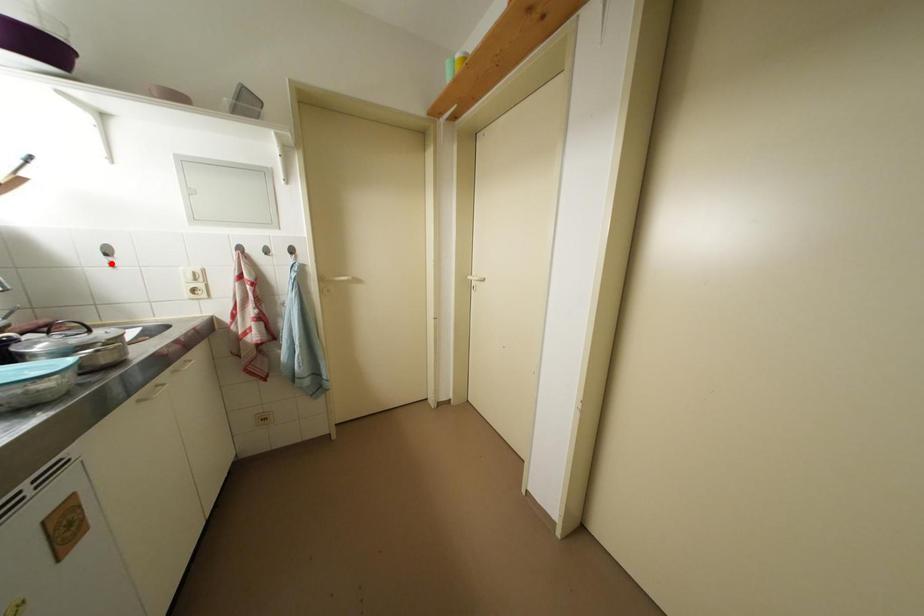
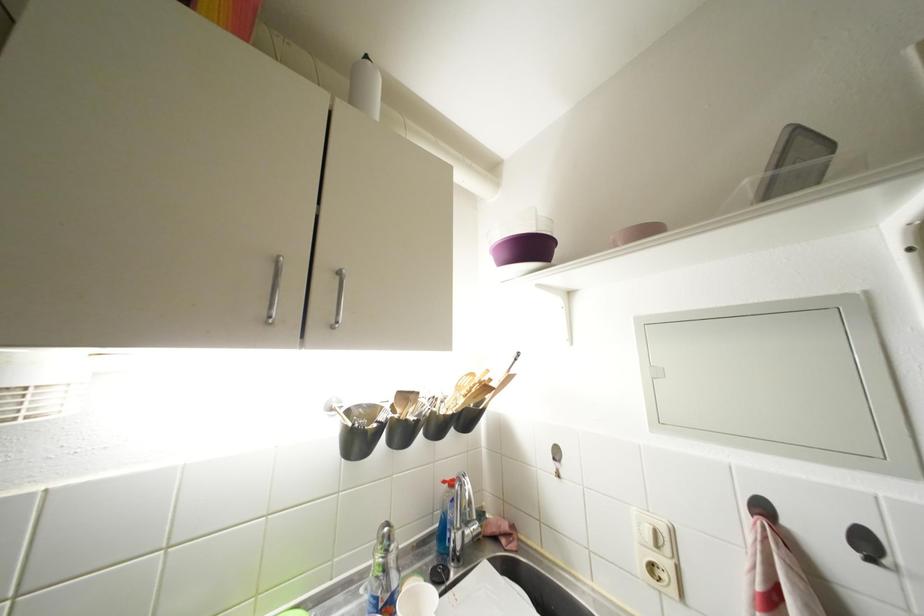
Question: I am providing you with two images of the same scene from different viewpoints. A red point is marked on the first image. At the location where the point appears in image 1, is it still visible in image 2?

Choices:
 (A) Yes
 (B) No

Answer: (A)